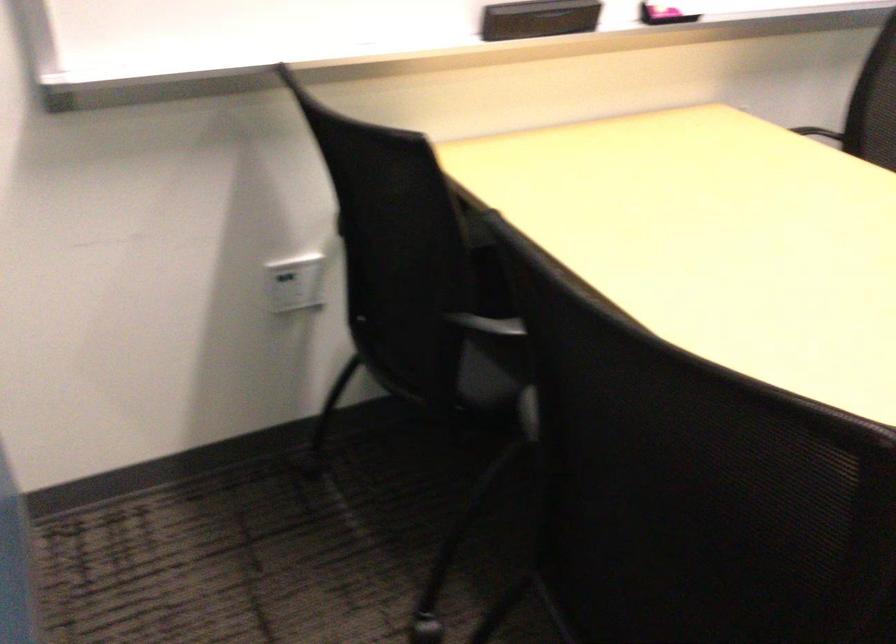
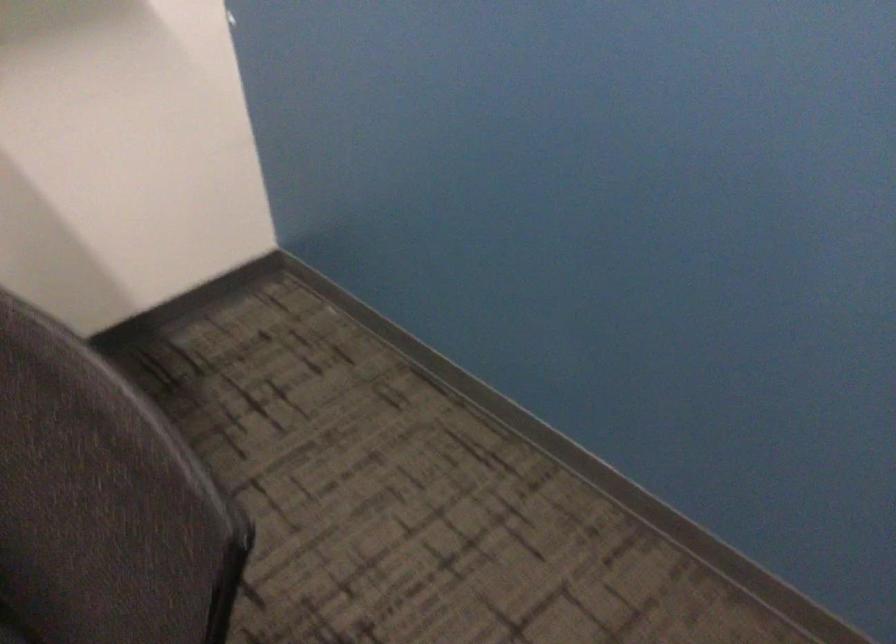
Question: In a continuous first-person perspective shot, in which direction is the camera moving?

Choices:
 (A) Left
 (B) Right
 (C) Forward
 (D) Backward

Answer: (B)